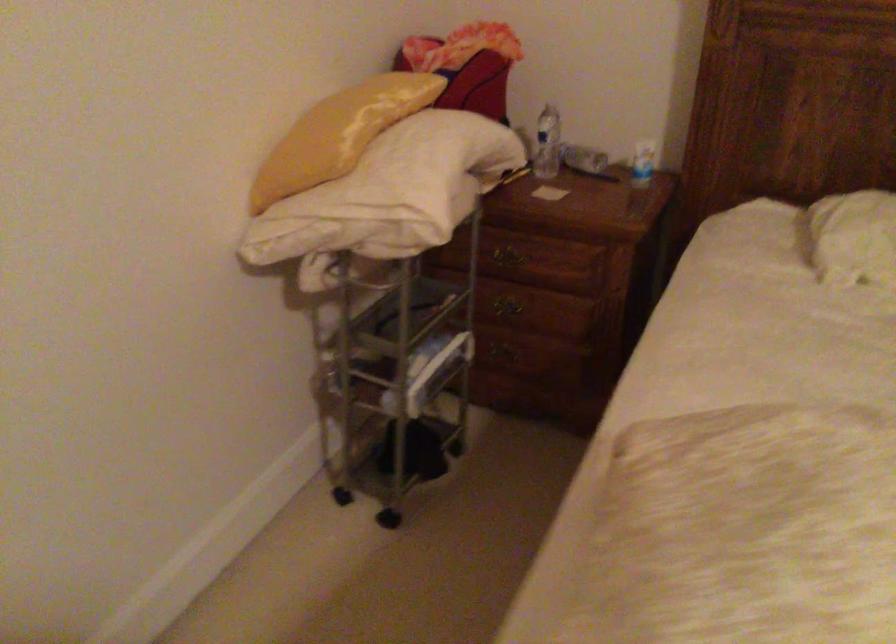
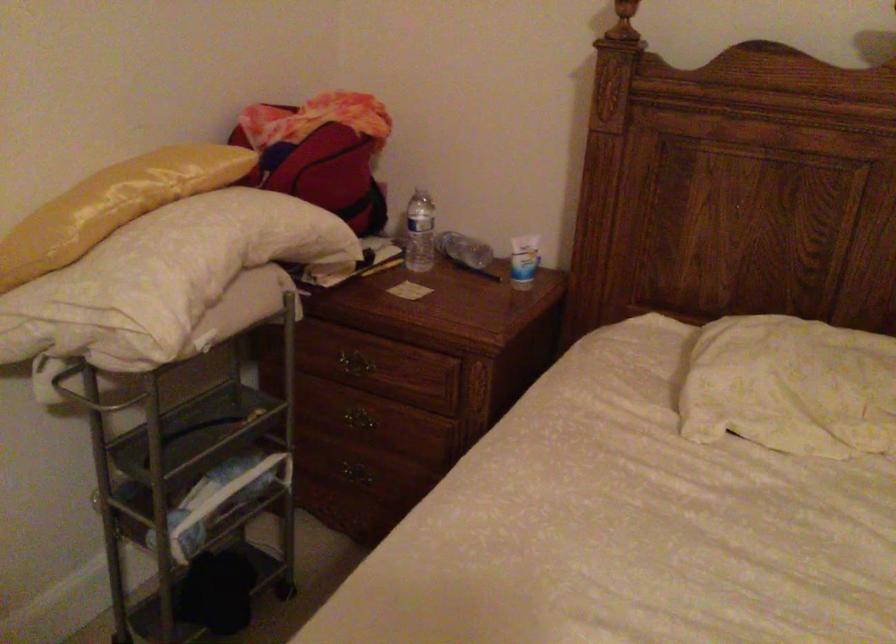
Where in the second image is the point corresponding to the point at 552,143 from the first image?

(419, 232)